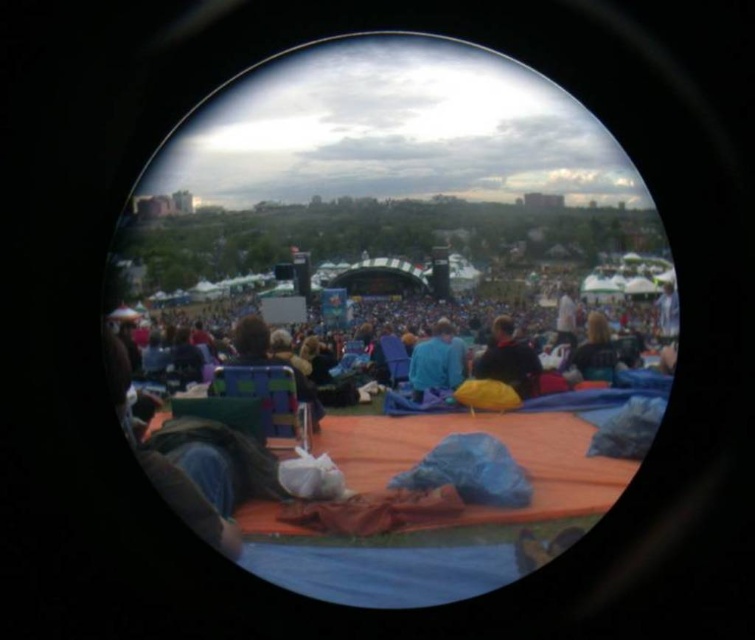
Question: Does dark brown leather jacket at center have a smaller size compared to blue fabric at center?

Choices:
 (A) yes
 (B) no

Answer: (B)

Question: Is dark brown leather jacket at center bigger than blue fabric at center?

Choices:
 (A) yes
 (B) no

Answer: (A)

Question: Estimate the real-world distances between objects in this image. Which object is closer to the blue fabric at center?

Choices:
 (A) dark blue fabric at center
 (B) dark brown leather jacket at center
 (C) blue fabric chairs at center

Answer: (C)

Question: From the image, what is the correct spatial relationship of blue fabric at center in relation to dark blue fabric at center?

Choices:
 (A) below
 (B) above

Answer: (A)

Question: Which point appears farthest from the camera in this image?

Choices:
 (A) (433, 378)
 (B) (589, 358)
 (C) (623, 344)

Answer: (C)

Question: Among these points, which one is farthest from the camera?

Choices:
 (A) 584,353
 (B) 513,358

Answer: (B)